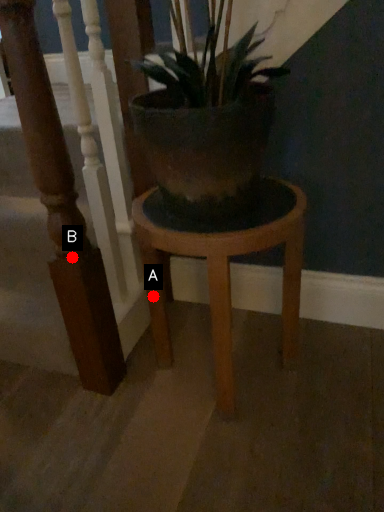
Question: Two points are circled on the image, labeled by A and B beside each circle. Which point is farther from the camera taking this photo?

Choices:
 (A) A is further
 (B) B is further

Answer: (A)